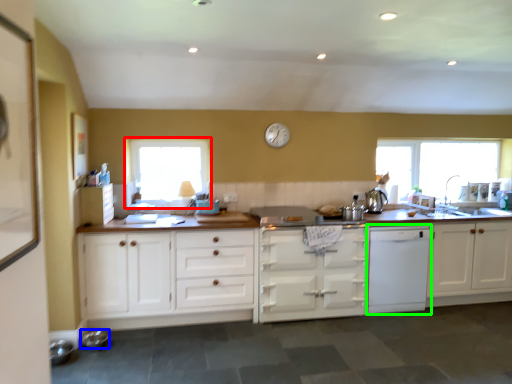
Question: Which object is the farthest from window (highlighted by a red box)? Choose among these: appliance (highlighted by a blue box) or kitchen appliance (highlighted by a green box).

Choices:
 (A) appliance
 (B) kitchen appliance

Answer: (B)